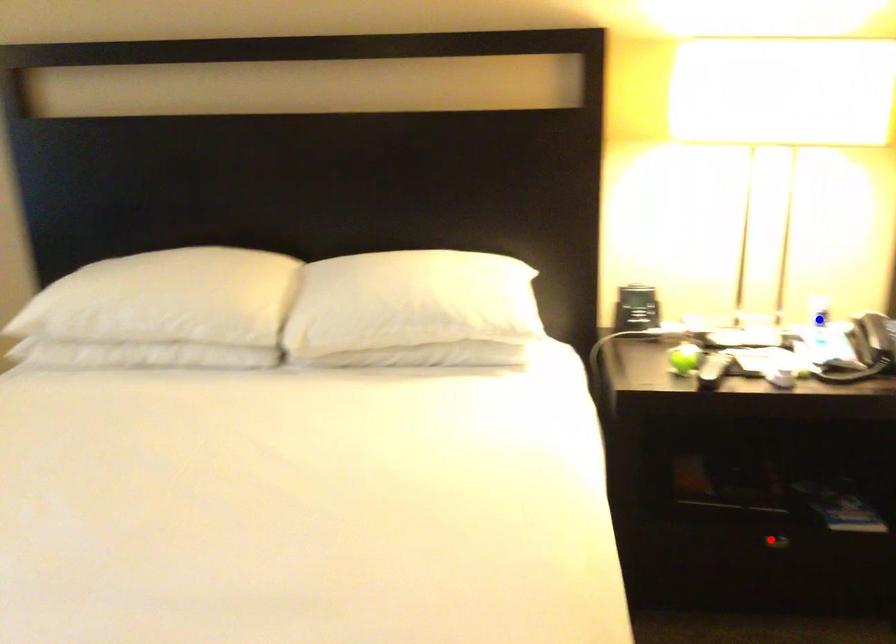
Question: In the image, two points are highlighted. Which point is nearer to the camera? Reply with the corresponding letter.

Choices:
 (A) blue point
 (B) red point

Answer: (B)